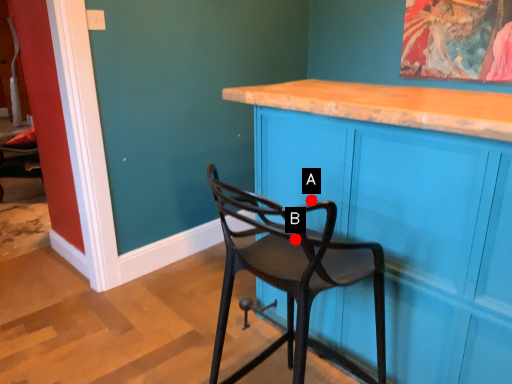
Question: Two points are circled on the image, labeled by A and B beside each circle. Which of the following is the farthest from the observer?

Choices:
 (A) A is further
 (B) B is further

Answer: (A)